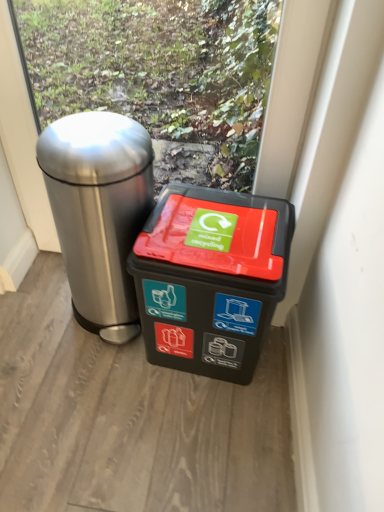
Question: Which direction should I rotate to look at black plastic recycling bin at center, which is the first waste container from right to left?

Choices:
 (A) left
 (B) right

Answer: (B)

Question: Is black plastic recycling bin at center, which is the first waste container from right to left, not close to polished stainless steel trash can at left, which ranks as the second waste container in right-to-left order?

Choices:
 (A) no
 (B) yes

Answer: (A)

Question: Can you confirm if black plastic recycling bin at center, which is the first waste container from right to left, is taller than polished stainless steel trash can at left, marked as the 1th waste container in a left-to-right arrangement?

Choices:
 (A) no
 (B) yes

Answer: (A)

Question: Could polished stainless steel trash can at left, which ranks as the second waste container in right-to-left order, be considered to be inside black plastic recycling bin at center, the 2th waste container viewed from the left?

Choices:
 (A) yes
 (B) no

Answer: (B)

Question: From a real-world perspective, is black plastic recycling bin at center, the 2th waste container viewed from the left, located beneath polished stainless steel trash can at left, which ranks as the second waste container in right-to-left order?

Choices:
 (A) yes
 (B) no

Answer: (A)

Question: Can you confirm if black plastic recycling bin at center, the 2th waste container viewed from the left, is bigger than polished stainless steel trash can at left, which ranks as the second waste container in right-to-left order?

Choices:
 (A) no
 (B) yes

Answer: (A)

Question: Is black plastic recycling bin at center, which is the first waste container from right to left, completely or partially outside of polished stainless steel trash can at left, which ranks as the second waste container in right-to-left order?

Choices:
 (A) no
 (B) yes

Answer: (B)

Question: Would you say polished stainless steel trash can at left, marked as the 1th waste container in a left-to-right arrangement, is a long distance from black plastic recycling bin at center, which is the first waste container from right to left?

Choices:
 (A) yes
 (B) no

Answer: (B)

Question: Can you confirm if polished stainless steel trash can at left, which ranks as the second waste container in right-to-left order, is smaller than black plastic recycling bin at center, which is the first waste container from right to left?

Choices:
 (A) yes
 (B) no

Answer: (B)

Question: Is polished stainless steel trash can at left, which ranks as the second waste container in right-to-left order, with black plastic recycling bin at center, the 2th waste container viewed from the left?

Choices:
 (A) yes
 (B) no

Answer: (B)

Question: Is black plastic recycling bin at center, which is the first waste container from right to left, completely or partially inside polished stainless steel trash can at left, marked as the 1th waste container in a left-to-right arrangement?

Choices:
 (A) no
 (B) yes

Answer: (A)

Question: Is polished stainless steel trash can at left, marked as the 1th waste container in a left-to-right arrangement, bigger than black plastic recycling bin at center, which is the first waste container from right to left?

Choices:
 (A) yes
 (B) no

Answer: (A)

Question: Is polished stainless steel trash can at left, marked as the 1th waste container in a left-to-right arrangement, further to camera compared to black plastic recycling bin at center, which is the first waste container from right to left?

Choices:
 (A) yes
 (B) no

Answer: (B)

Question: From a real-world perspective, is polished stainless steel trash can at left, which ranks as the second waste container in right-to-left order, positioned above or below black plastic recycling bin at center, the 2th waste container viewed from the left?

Choices:
 (A) below
 (B) above

Answer: (B)